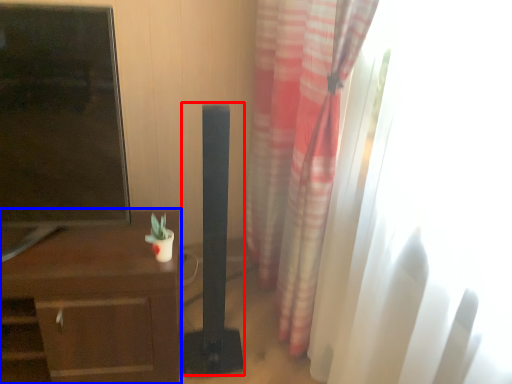
Question: Which of the following is the closest to the observer, speaker (highlighted by a red box) or desk (highlighted by a blue box)?

Choices:
 (A) speaker
 (B) desk

Answer: (A)